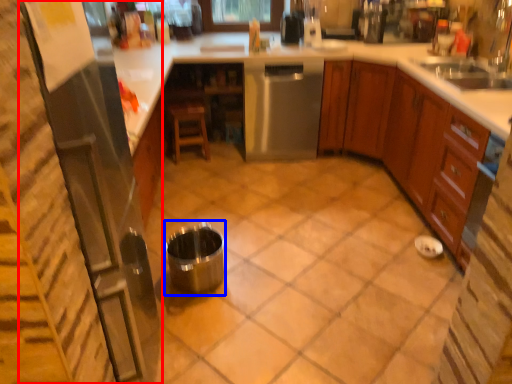
Question: Which object is further to the camera taking this photo, appliance (highlighted by a red box) or appliance (highlighted by a blue box)?

Choices:
 (A) appliance
 (B) appliance

Answer: (B)